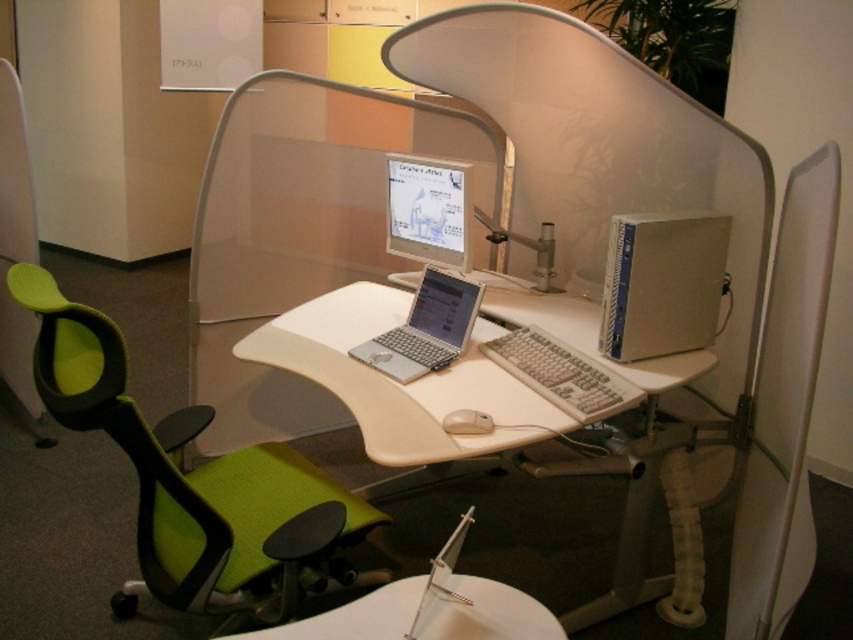
You are an office worker who needs to sit down at the workstation. You see the green mesh swivel chair at left and the silver metallic laptop at center. Which object should you approach first to sit in the chair?

You should approach the green mesh swivel chair at left first because it is positioned to the left of the silver metallic laptop at center, meaning it is located on the side opposite to the laptop.

You are organizing cables for the satin silver computer tower at right and the silver metallic laptop at center. Based on their positions, which device is closer to the edge of the desk?

The satin silver computer tower at right is positioned over the silver metallic laptop at center, meaning it is closer to the edge of the desk.

You are setting up a new monitor that requires 30 cm of space. You have the white plastic desk at center and the silver metallic laptop at center. Which object can accommodate the monitor?

The white plastic desk at center is wider than the silver metallic laptop at center, so it can accommodate the monitor.